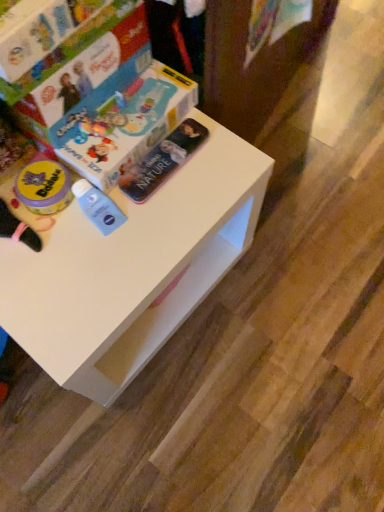
Question: Which direction should I rotate to look at metallic silver book at center, positioned as the 2th paperback book in top-to-bottom order?

Choices:
 (A) left
 (B) right

Answer: (A)

Question: Can you confirm if hardcover book at upper left, the second paperback book ordered from the bottom, is positioned to the left of white matte table at center?

Choices:
 (A) yes
 (B) no

Answer: (A)

Question: Is hardcover book at upper left, which is the first paperback book from top to bottom, thinner than white matte table at center?

Choices:
 (A) yes
 (B) no

Answer: (A)

Question: Is hardcover book at upper left, the second paperback book ordered from the bottom, wider than white matte table at center?

Choices:
 (A) yes
 (B) no

Answer: (B)

Question: Does hardcover book at upper left, the second paperback book ordered from the bottom, have a smaller size compared to white matte table at center?

Choices:
 (A) yes
 (B) no

Answer: (A)

Question: Is hardcover book at upper left, which is the first paperback book from top to bottom, completely or partially outside of white matte table at center?

Choices:
 (A) no
 (B) yes

Answer: (B)

Question: Does hardcover book at upper left, the second paperback book ordered from the bottom, have a lesser height compared to white matte table at center?

Choices:
 (A) no
 (B) yes

Answer: (B)

Question: Can you confirm if white matte table at center is shorter than hardcover book at upper left, which is the first paperback book from top to bottom?

Choices:
 (A) yes
 (B) no

Answer: (B)

Question: From the image's perspective, is white matte table at center located above hardcover book at upper left, which is the first paperback book from top to bottom?

Choices:
 (A) yes
 (B) no

Answer: (B)

Question: Is white matte table at center positioned far away from hardcover book at upper left, the second paperback book ordered from the bottom?

Choices:
 (A) yes
 (B) no

Answer: (B)

Question: Is hardcover book at upper left, the second paperback book ordered from the bottom, at the back of white matte table at center?

Choices:
 (A) no
 (B) yes

Answer: (A)

Question: Can you confirm if white matte table at center is bigger than hardcover book at upper left, the second paperback book ordered from the bottom?

Choices:
 (A) no
 (B) yes

Answer: (B)

Question: From the image's perspective, does white matte table at center appear lower than hardcover book at upper left, the second paperback book ordered from the bottom?

Choices:
 (A) yes
 (B) no

Answer: (A)

Question: Is hardcover book at upper left, the second paperback book ordered from the bottom, looking in the opposite direction of metallic silver book at center, marked as the 1th paperback book in a bottom-to-top arrangement?

Choices:
 (A) yes
 (B) no

Answer: (B)